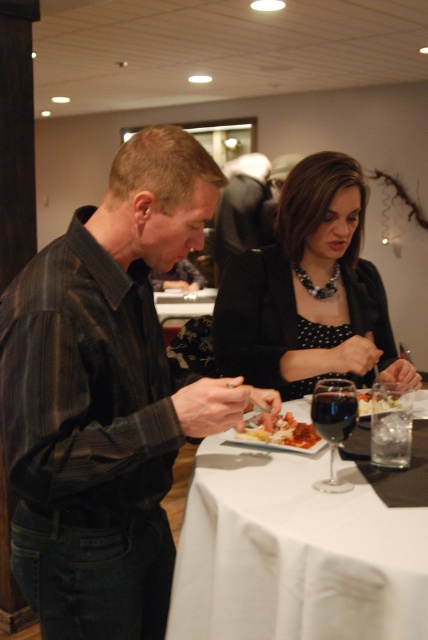
Question: Which object is closer to the camera taking this photo?

Choices:
 (A) smooth white pasta at center
 (B) black striped shirt at center
 (C) transparent glass at table center
 (D) white cloth at center

Answer: (D)

Question: Is dark glass at table center to the right of smooth white pasta at center from the viewer's perspective?

Choices:
 (A) yes
 (B) no

Answer: (A)

Question: Which point is farther to the camera?

Choices:
 (A) smooth creamy pasta at center
 (B) black dotted dress at center
 (C) clear glass wine glass at table center
 (D) white cloth at center

Answer: (A)

Question: Which object appears farthest from the camera in this image?

Choices:
 (A) smooth creamy pasta at center
 (B) black striped shirt at center
 (C) white cloth at center

Answer: (A)

Question: From the image, what is the correct spatial relationship of transparent glass at table center in relation to smooth white pasta at center?

Choices:
 (A) left
 (B) right

Answer: (B)

Question: Does smooth white pasta at center appear on the right side of smooth creamy pasta at center?

Choices:
 (A) yes
 (B) no

Answer: (B)